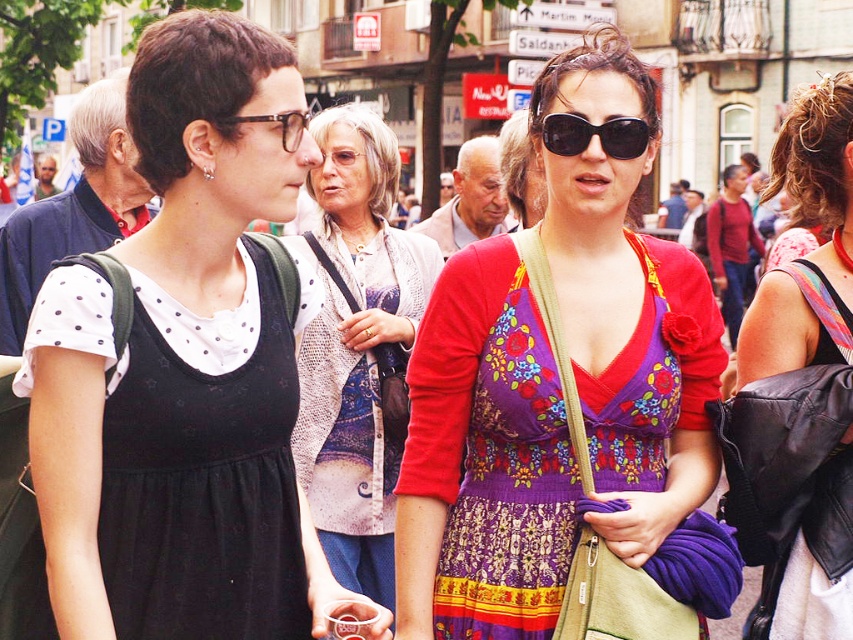
You are a photographer trying to capture a candid shot of the two women in the lively street scene. You want to ensure that the black plastic sunglasses at center are clearly visible in the frame. Based on their position, where should you aim your camera?

The black plastic sunglasses at center are located at coordinates point (595, 134), so you should aim your camera at that specific point to ensure they are clearly visible in the frame.

You are a fashion designer observing the street scene. You need to determine which item is bigger between the printed fabric sweater at center and the matte black glasses at upper center. Which one is larger?

The printed fabric sweater at center is larger in size than the matte black glasses at upper center.